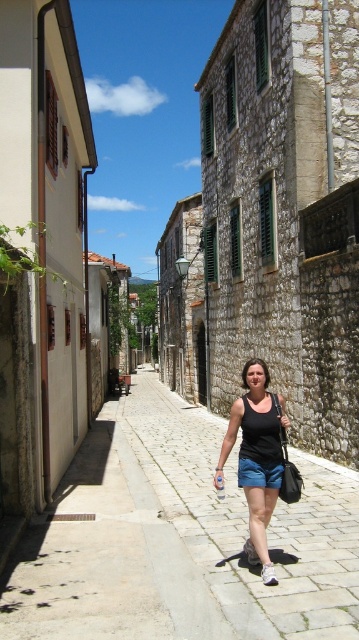
Question: Which point is farther from the camera taking this photo?

Choices:
 (A) (333, 520)
 (B) (235, 403)

Answer: (A)

Question: Observing the image, what is the correct spatial positioning of gray cobblestone pavement at center in reference to black fabric tank top at center?

Choices:
 (A) above
 (B) below

Answer: (B)

Question: Which point is closer to the camera taking this photo?

Choices:
 (A) (250, 484)
 (B) (255, 621)

Answer: (B)

Question: In this image, where is gray cobblestone pavement at center located relative to black fabric tank top at center?

Choices:
 (A) right
 (B) left

Answer: (B)

Question: Is gray cobblestone pavement at center bigger than black fabric tank top at center?

Choices:
 (A) no
 (B) yes

Answer: (B)